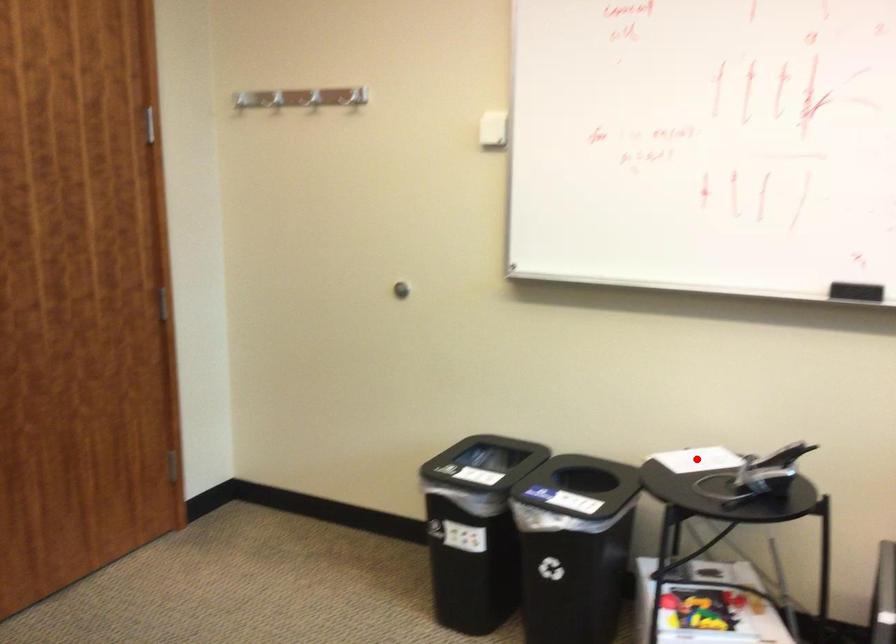
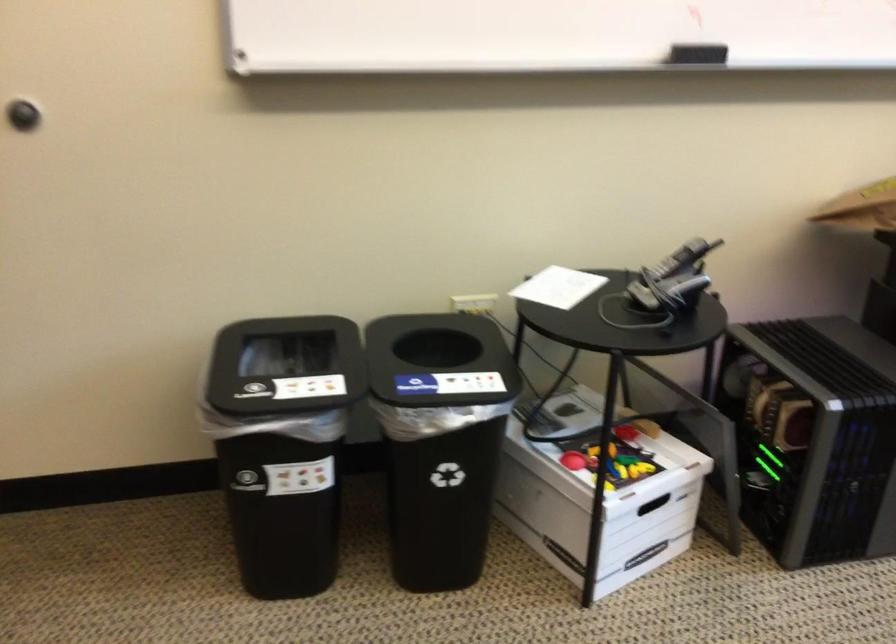
Find the pixel in the second image that matches the highlighted location in the first image.

(558, 287)